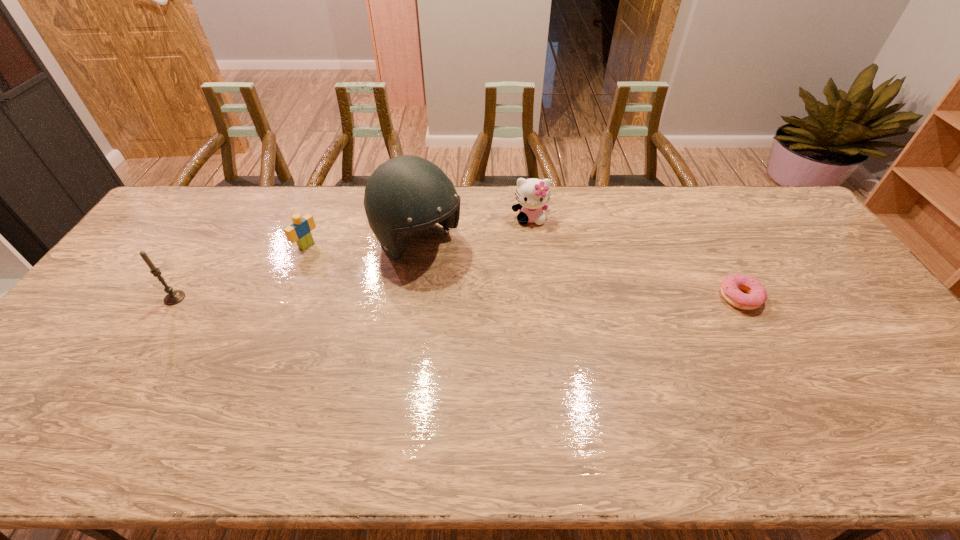
This screenshot has width=960, height=540. Identify the location of candle. (173, 297).

The height and width of the screenshot is (540, 960). Find the location of `the shortest object`. the shortest object is located at coordinates tap(730, 287).

Locate an element on the screen. This screenshot has height=540, width=960. the rightmost object is located at coordinates (730, 287).

You are a GUI agent. You are given a task and a screenshot of the screen. Output one action in this format:
    pyautogui.click(x=<x>, y=<y>)
    Task: Click on the fourth object from right to left
    This screenshot has width=960, height=540.
    Given the screenshot: What is the action you would take?
    pyautogui.click(x=299, y=231)

Identify the location of Lego. (299, 231).

You are a GUI agent. You are given a task and a screenshot of the screen. Output one action in this format:
    pyautogui.click(x=<x>, y=<y>)
    Task: Click on the third object from right to left
    This screenshot has width=960, height=540.
    Given the screenshot: What is the action you would take?
    pyautogui.click(x=406, y=193)

What are the coordinates of `football helmet` in the screenshot? It's located at (406, 193).

Where is `the fourth object from left to right`? This screenshot has width=960, height=540. the fourth object from left to right is located at coordinates (532, 194).

The height and width of the screenshot is (540, 960). In order to click on kitten in this screenshot , I will do `click(532, 194)`.

The width and height of the screenshot is (960, 540). What are the coordinates of `free space located on the back of the candle` in the screenshot? It's located at (210, 242).